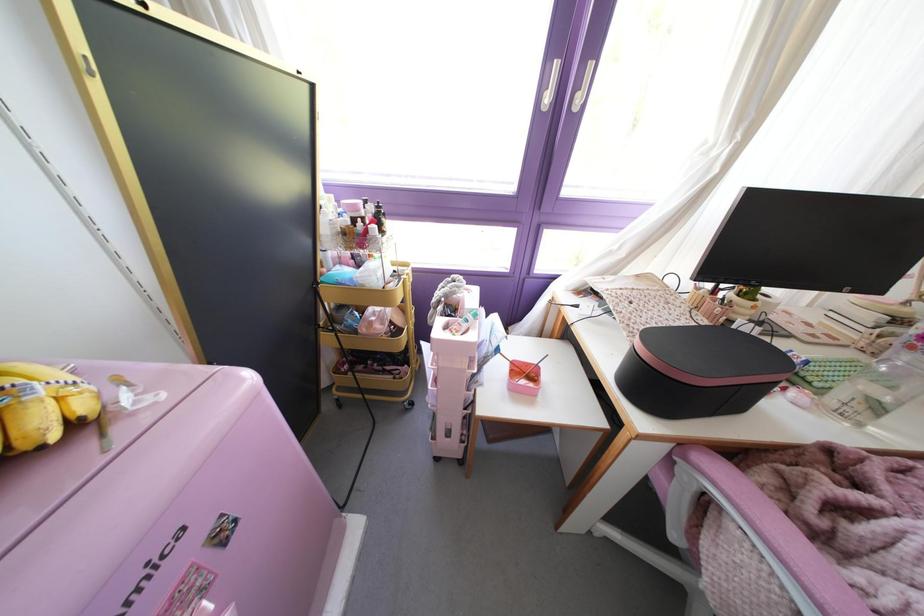
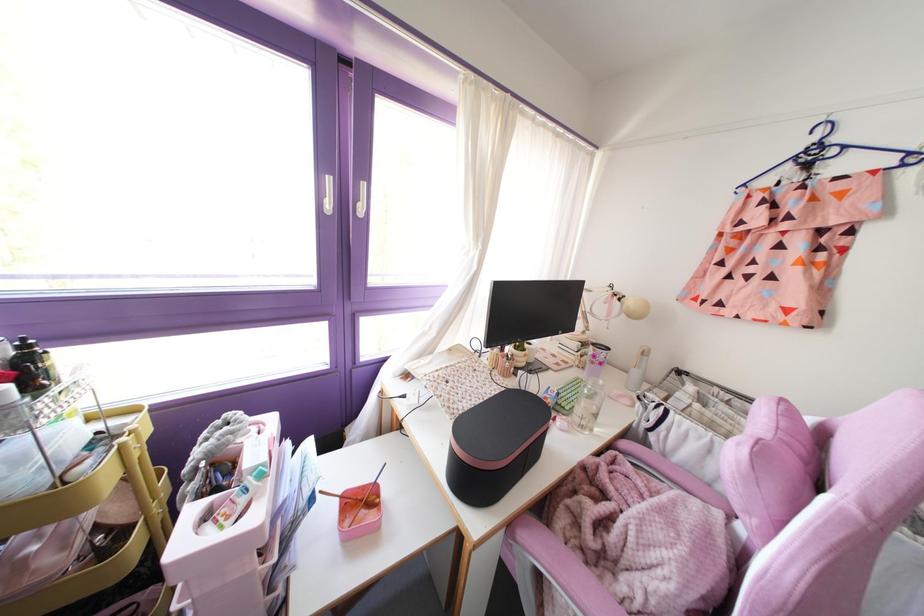
Locate, in the second image, the point that corresponds to (475,315) in the first image.

(261, 475)